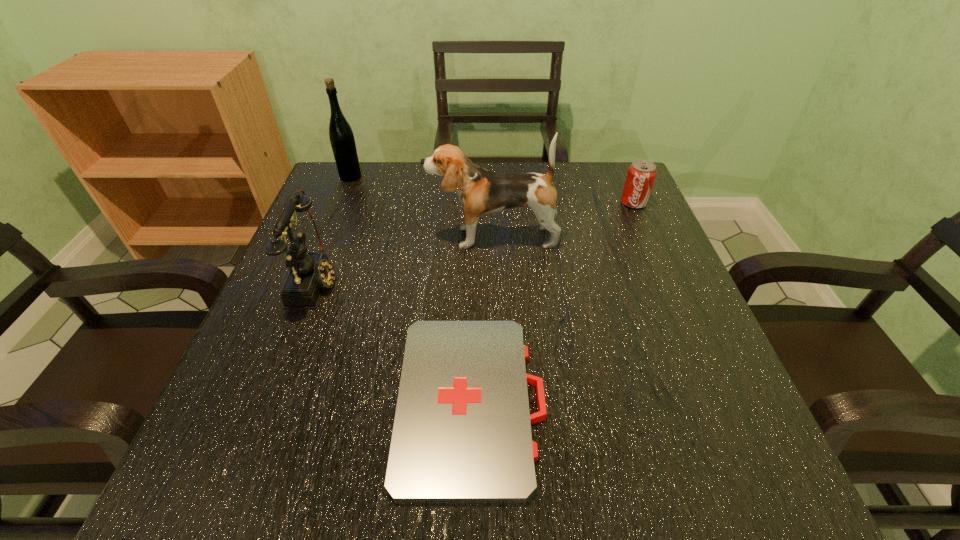
The height and width of the screenshot is (540, 960). I want to click on vacant space located at the face of the puppy, so click(x=307, y=237).

You are a GUI agent. You are given a task and a screenshot of the screen. Output one action in this format:
    pyautogui.click(x=<x>, y=<y>)
    Task: Click on the vacant space positioned on the dial of the third shortest object
    
    Given the screenshot: What is the action you would take?
    pyautogui.click(x=386, y=280)

At what (x,y) coordinates should I click in order to perform the action: click on free space located 0.330m on the left of the soda can. Please return your answer as a coordinate pair (x, y). Looking at the image, I should click on (486, 202).

You are a GUI agent. You are given a task and a screenshot of the screen. Output one action in this format:
    pyautogui.click(x=<x>, y=<y>)
    Task: Click on the vacant space situated 0.210m on handle side the shortest object
    Image resolution: width=960 pixels, height=540 pixels.
    Given the screenshot: What is the action you would take?
    pyautogui.click(x=678, y=402)

Image resolution: width=960 pixels, height=540 pixels. I want to click on beer bottle that is at the far edge, so click(342, 140).

I want to click on soda can that is at the far edge, so click(641, 174).

Find the location of a particular element. The height and width of the screenshot is (540, 960). object located at the near edge is located at coordinates (462, 433).

This screenshot has height=540, width=960. Identify the location of beer bottle situated at the left edge. (342, 140).

Locate an element on the screen. The image size is (960, 540). telephone that is positioned at the left edge is located at coordinates (310, 272).

Identify the location of object present at the right edge. Image resolution: width=960 pixels, height=540 pixels. (641, 174).